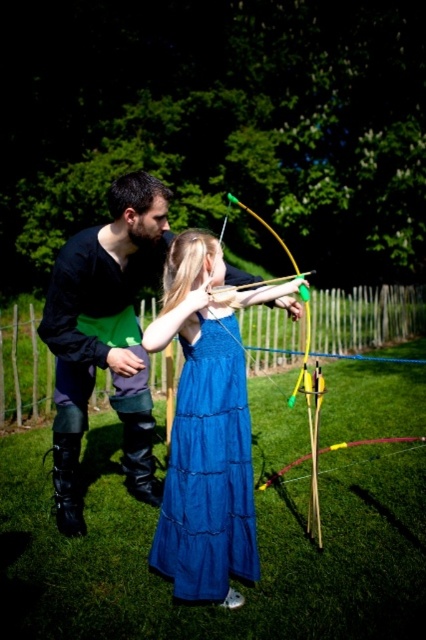
Is blue cotton dress at center to the left of yellow wood bow at center from the viewer's perspective?

Correct, you'll find blue cotton dress at center to the left of yellow wood bow at center.

Between blue cotton dress at center and yellow wood bow at center, which one appears on the left side from the viewer's perspective?

From the viewer's perspective, blue cotton dress at center appears more on the left side.

Who is more distant from viewer, (218, 465) or (244, 211)?

Point (244, 211)

At what (x,y) coordinates should I click in order to perform the action: click on blue cotton dress at center. Please return your answer as a coordinate pair (x, y). This screenshot has width=426, height=640. Looking at the image, I should click on (209, 472).

Does black leather boots at left have a lesser width compared to yellow wood bow at center?

Yes, black leather boots at left is thinner than yellow wood bow at center.

Does black leather boots at left have a smaller size compared to yellow wood bow at center?

Indeed, black leather boots at left has a smaller size compared to yellow wood bow at center.

You are a GUI agent. You are given a task and a screenshot of the screen. Output one action in this format:
    pyautogui.click(x=<x>, y=<y>)
    Task: Click on the black leather boots at left
    
    Given the screenshot: What is the action you would take?
    pyautogui.click(x=104, y=337)

Does point (118, 316) lie behind point (222, 492)?

Yes, it is.

Can you confirm if black leather boots at left is taller than blue cotton dress at center?

Correct, black leather boots at left is much taller as blue cotton dress at center.

Where is `black leather boots at left`? This screenshot has width=426, height=640. black leather boots at left is located at coordinates (104, 337).